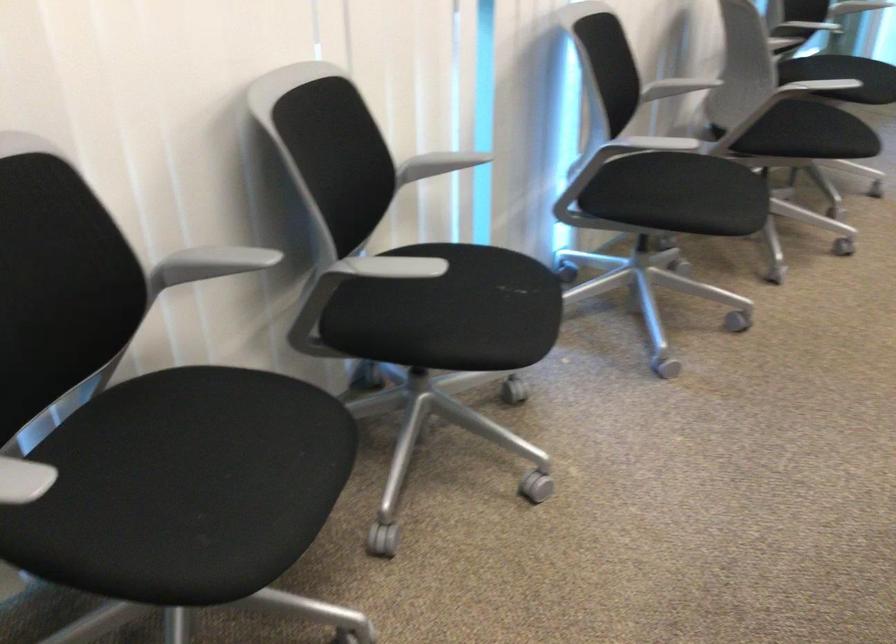
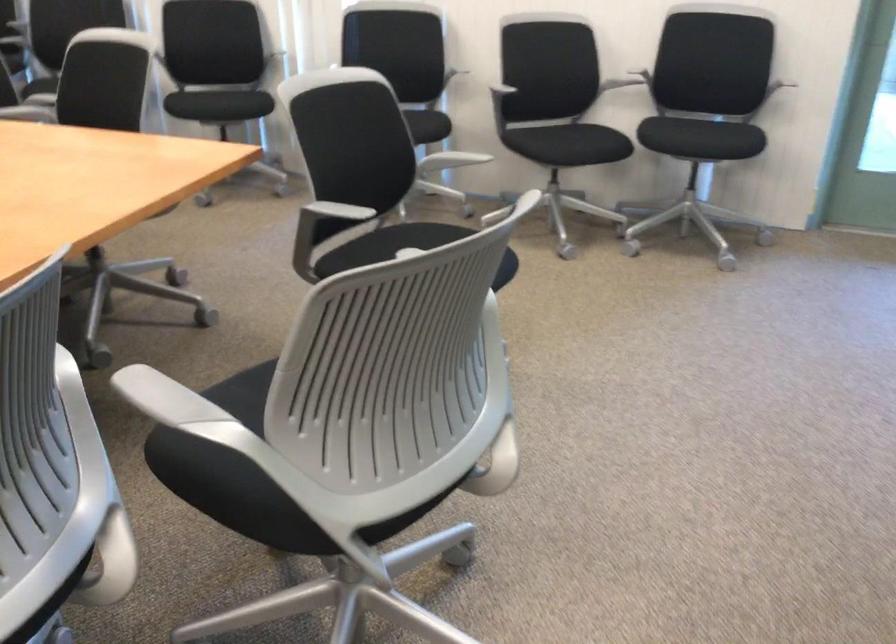
Question: I am providing you with two images of the same scene from different viewpoints. Please identify which objects are invisible in image2.

Choices:
 (A) gray adjustment knob
 (B) black chair sitting surface
 (C) gray chair armrest
 (D) pen in holder

Answer: (B)